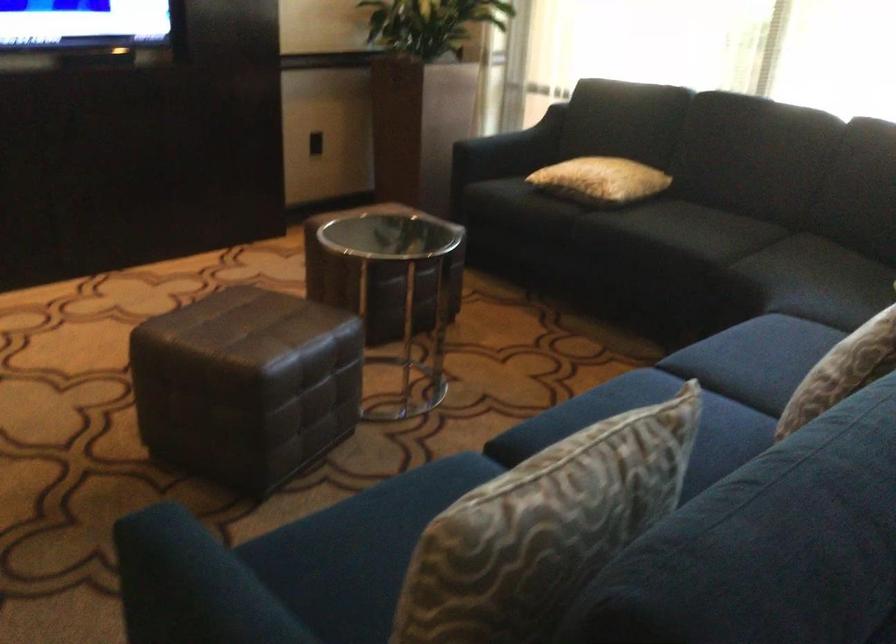
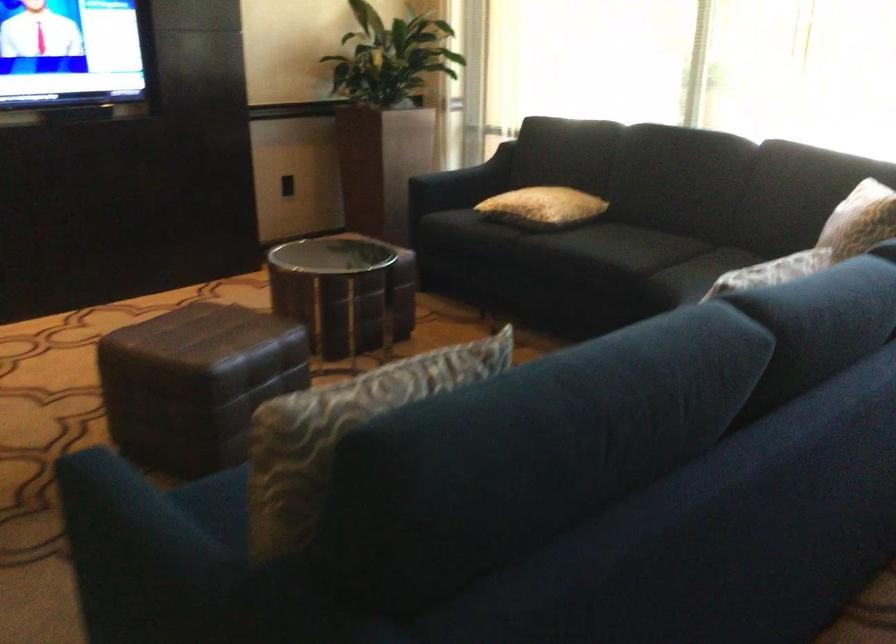
Locate, in the second image, the point that corresponds to [530,550] in the first image.

(340, 431)